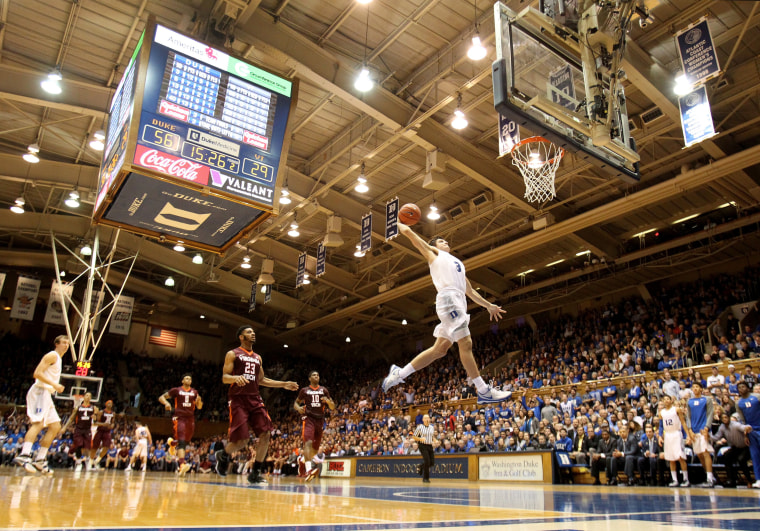
The width and height of the screenshot is (760, 531). Identify the location of ceiling. (323, 118).